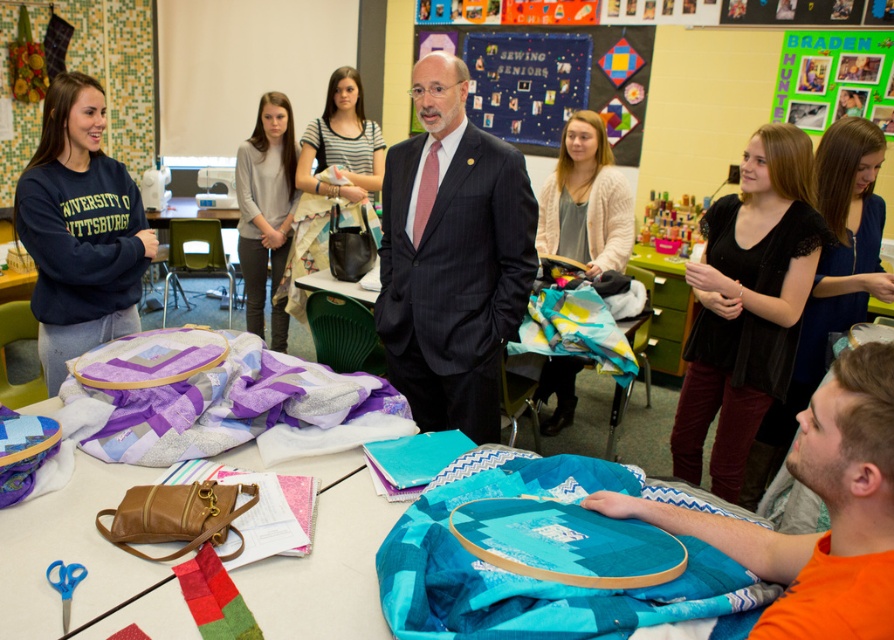
Question: Is dark pinstripe suit at center wider than blue fabric bulletin board at center?

Choices:
 (A) yes
 (B) no

Answer: (B)

Question: Among these objects, which one is nearest to the camera?

Choices:
 (A) black lace cardigan at upper right
 (B) orange cotton shirt at lower right

Answer: (B)

Question: Which of the following is the closest to the observer?

Choices:
 (A) (544, 35)
 (B) (240, 371)
 (C) (687, 480)

Answer: (B)

Question: Is dark pinstripe suit at center wider than orange cotton shirt at lower right?

Choices:
 (A) yes
 (B) no

Answer: (A)

Question: Can you confirm if teal fabric at lower right is positioned above navy fleece sweatshirt at left?

Choices:
 (A) yes
 (B) no

Answer: (B)

Question: Which is farther from the dark pinstripe suit at center?

Choices:
 (A) navy fleece sweatshirt at left
 (B) black lace cardigan at upper right
 (C) teal fabric at lower right
 (D) orange cotton shirt at lower right

Answer: (D)